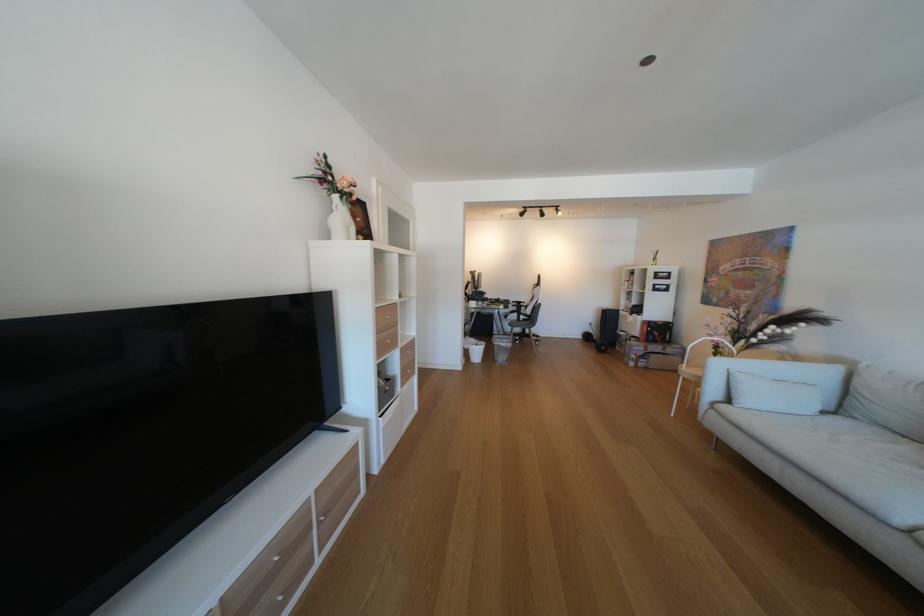
This screenshot has height=616, width=924. Describe the element at coordinates (800, 377) in the screenshot. I see `the light blue pillow` at that location.